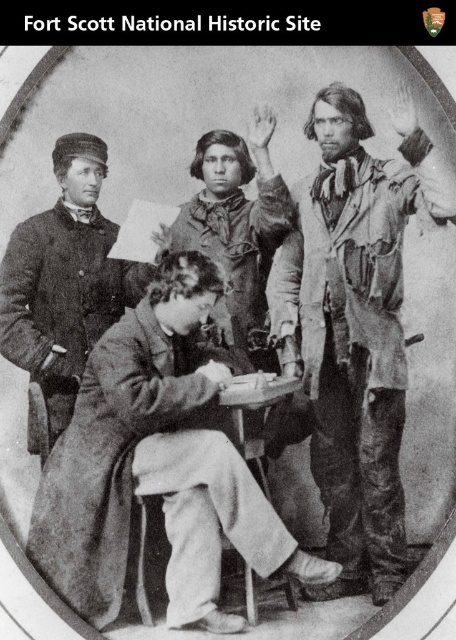
Which is in front, point (392, 442) or point (73, 401)?

Point (392, 442) is in front.

Is ragged fabric shirt at right bigger than smooth leather jacket at center?

Correct, ragged fabric shirt at right is larger in size than smooth leather jacket at center.

Between point (385, 205) and point (36, 452), which one is positioned in front?

Point (385, 205)

Find the location of a particular element. The width and height of the screenshot is (456, 640). ragged fabric shirt at right is located at coordinates (355, 326).

Is smooth leather jacket at center closer to the viewer compared to worn fabric shirt at center?

No.

Image resolution: width=456 pixels, height=640 pixels. Describe the element at coordinates (65, 280) in the screenshot. I see `smooth leather jacket at center` at that location.

Who is more distant from viewer, (89,256) or (232,307)?

The point (89,256) is behind.

Locate an element on the screen. smooth leather jacket at center is located at coordinates (65, 280).

Does ragged fabric shirt at right have a greater height compared to worn fabric shirt at center?

Yes.

Who is shorter, ragged fabric shirt at right or worn fabric shirt at center?

With less height is worn fabric shirt at center.

Is point (363, 275) positioned before point (243, 291)?

Yes, point (363, 275) is in front of point (243, 291).

In order to click on ragged fabric shirt at right in this screenshot , I will do `click(355, 326)`.